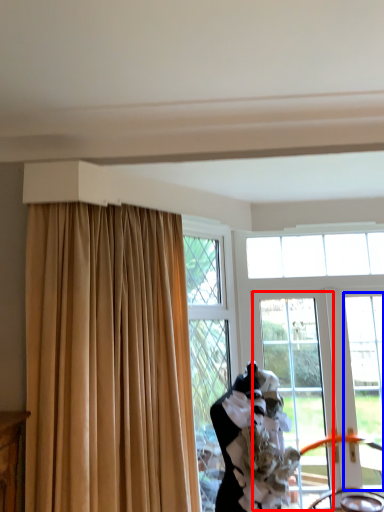
Question: Which of the following is the closest to the observer, window screen (highlighted by a red box) or window (highlighted by a blue box)?

Choices:
 (A) window screen
 (B) window

Answer: (B)